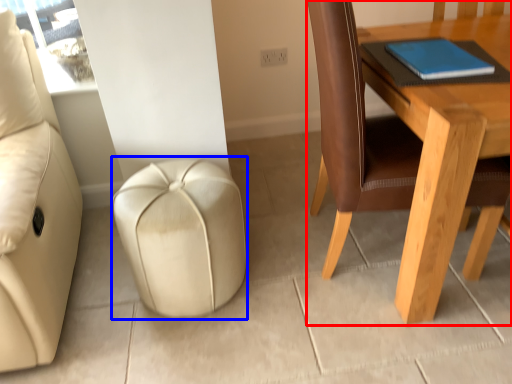
Question: Among these objects, which one is farthest to the camera, table (highlighted by a red box) or stool (highlighted by a blue box)?

Choices:
 (A) table
 (B) stool

Answer: (B)